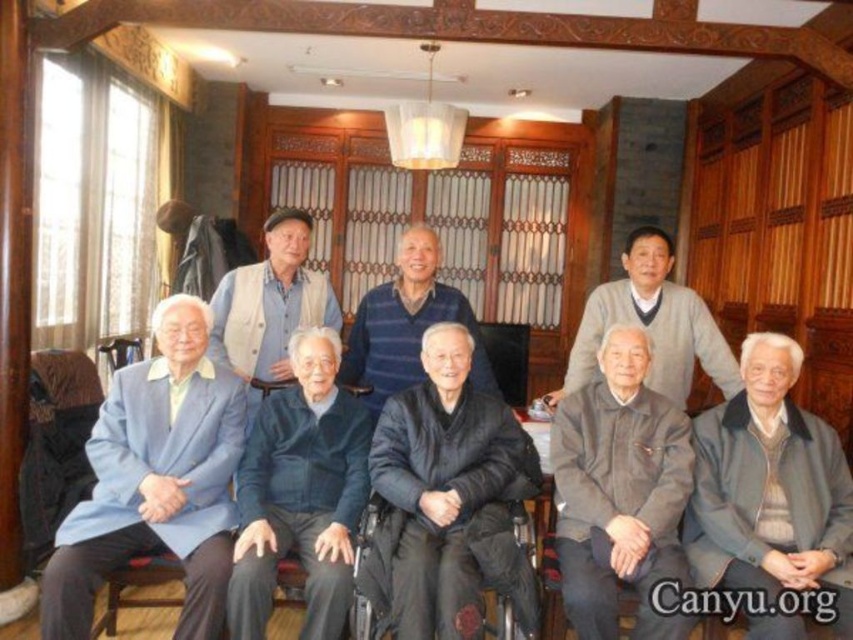
Which is behind, point (300, 426) or point (535, 492)?

Point (300, 426)

Between point (312, 474) and point (524, 608), which one is positioned in front?

Point (524, 608) is more forward.

Locate an element on the screen. This screenshot has width=853, height=640. dark blue fabric jacket at lower center is located at coordinates (300, 493).

Who is more forward, (751, 516) or (368, 326)?

Point (751, 516)

Does gray fabric jacket at lower right have a smaller size compared to dark blue sweater at center?

No, gray fabric jacket at lower right is not smaller than dark blue sweater at center.

This screenshot has height=640, width=853. What are the coordinates of `gray fabric jacket at lower right` in the screenshot? It's located at (770, 486).

Is light blue fabric suit at lower left thinner than gray sweater at upper center?

Yes.

This screenshot has height=640, width=853. I want to click on light blue fabric suit at lower left, so click(155, 481).

Does point (88, 460) come in front of point (653, 262)?

Yes.

You are a GUI agent. You are given a task and a screenshot of the screen. Output one action in this format:
    pyautogui.click(x=<x>, y=<y>)
    Task: Click on the light blue fabric suit at lower left
    
    Given the screenshot: What is the action you would take?
    pyautogui.click(x=155, y=481)